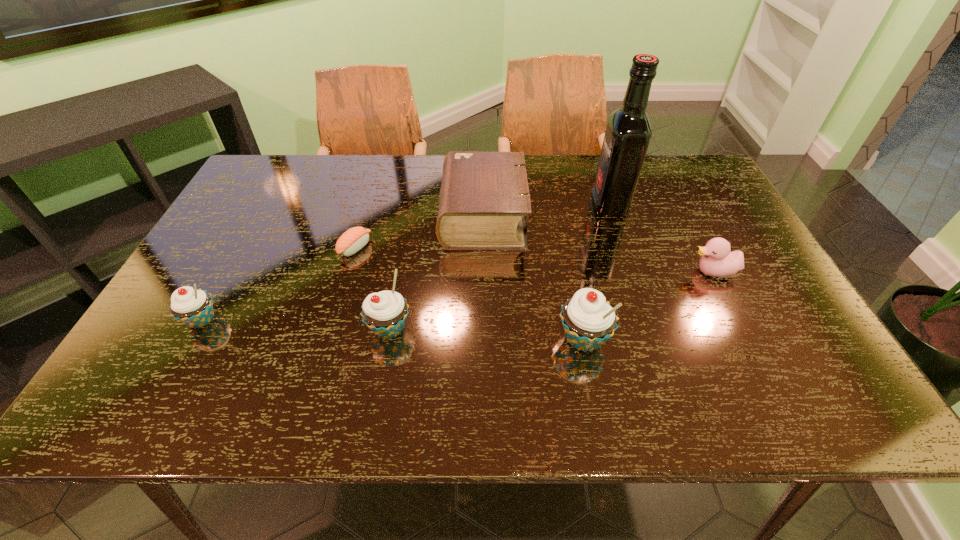
Identify the location of blank space located 0.320m on the spine side of the Bible. The image size is (960, 540). (330, 216).

Find the location of a particular element. This screenshot has height=540, width=960. free region located on the left of the second object from left to right is located at coordinates (311, 247).

Find the location of `free region located on the front-facing side of the duckling`. free region located on the front-facing side of the duckling is located at coordinates (635, 272).

At what (x,y) coordinates should I click in order to perform the action: click on blank space located 0.130m on the front-facing side of the duckling. Please return your answer as a coordinate pair (x, y). This screenshot has width=960, height=540. Looking at the image, I should click on (638, 272).

At what (x,y) coordinates should I click in order to perform the action: click on free space located 0.330m on the front-facing side of the duckling. Please return your answer as a coordinate pair (x, y). Looking at the image, I should click on (559, 272).

Locate an element on the screen. liquor at the far edge is located at coordinates (628, 131).

Identify the location of Bible that is at the far edge. (484, 196).

Image resolution: width=960 pixels, height=540 pixels. Identify the location of object positioned at the left edge. (193, 307).

Locate an element on the screen. Image resolution: width=960 pixels, height=540 pixels. object that is at the right edge is located at coordinates (717, 260).

Image resolution: width=960 pixels, height=540 pixels. In the image, there is a desktop. Find the location of `free space at the far edge`. free space at the far edge is located at coordinates (318, 158).